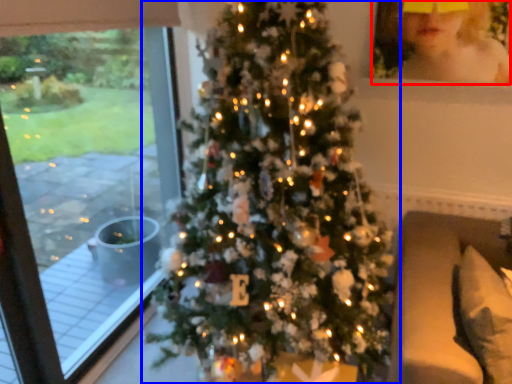
Question: Among these objects, which one is farthest to the camera, toddler (highlighted by a red box) or christmas tree (highlighted by a blue box)?

Choices:
 (A) toddler
 (B) christmas tree

Answer: (A)